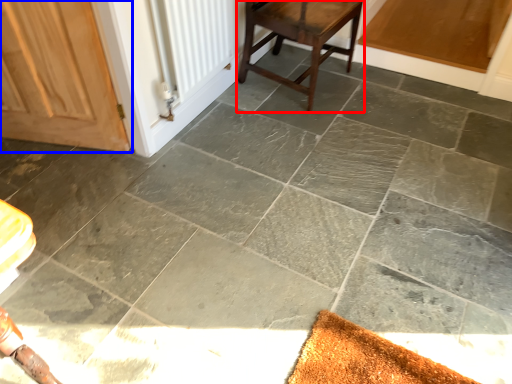
Question: Which point is closer to the camera, stool (highlighted by a red box) or door (highlighted by a blue box)?

Choices:
 (A) stool
 (B) door

Answer: (B)